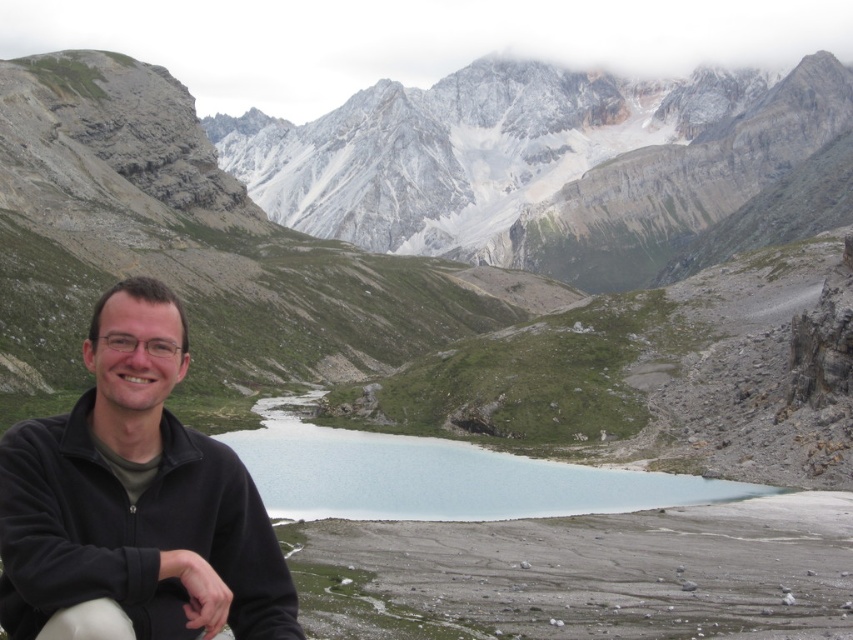
Question: Can you confirm if black fleece jacket at lower left is smaller than clear blue water at center?

Choices:
 (A) yes
 (B) no

Answer: (A)

Question: Which object is the closest to the clear blue water at center?

Choices:
 (A) black fleece jacket at lower left
 (B) matte gray rock at center
 (C) gray rocky mountain at upper center

Answer: (A)

Question: Considering the relative positions of black fleece jacket at lower left and clear blue water at center in the image provided, where is black fleece jacket at lower left located with respect to clear blue water at center?

Choices:
 (A) left
 (B) right

Answer: (A)

Question: Estimate the real-world distances between objects in this image. Which object is farther from the black fleece jacket at lower left?

Choices:
 (A) clear blue water at center
 (B) gray rocky mountain at upper center

Answer: (B)

Question: Which point is farther to the camera?

Choices:
 (A) clear blue water at center
 (B) gray rocky mountain at upper center
 (C) matte gray rock at center
 (D) black fleece jacket at lower left

Answer: (B)

Question: Is matte gray rock at center behind gray rocky mountain at upper center?

Choices:
 (A) yes
 (B) no

Answer: (B)